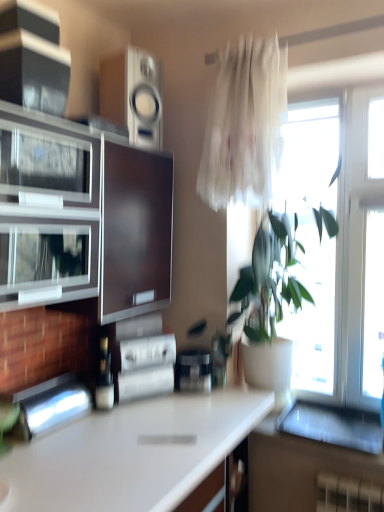
Question: Looking at the image, does translucent white curtain at upper right seem bigger or smaller compared to white glossy computer desk at lower right?

Choices:
 (A) small
 (B) big

Answer: (B)

Question: Would you say translucent white curtain at upper right is to the left or to the right of white glossy computer desk at lower right in the picture?

Choices:
 (A) right
 (B) left

Answer: (B)

Question: Estimate the real-world distances between objects in this image. Which object is closer to the white glossy countertop at center?

Choices:
 (A) satin black coffee maker at center, the 2th appliance positioned from the bottom
 (B) white glossy computer desk at lower right
 (C) silver metallic speaker at upper center, the fifth appliance ordered from the bottom
 (D) metallic silver toaster at center, acting as the 3th appliance starting from the bottom
 (E) matte brown cabinet at left

Answer: (D)

Question: Considering the real-world distances, which object is closest to the silver metallic speaker at upper center, positioned as the 1th appliance in top-to-bottom order?

Choices:
 (A) black glossy speaker at upper left, marked as the 4th appliance in a bottom-to-top arrangement
 (B) metallic stainless steel toaster at lower left, which is the 5th appliance from top to bottom
 (C) transparent glass window at right
 (D) matte brown cabinet at left
 (E) satin black coffee maker at center, arranged as the fourth appliance when viewed from the top

Answer: (D)